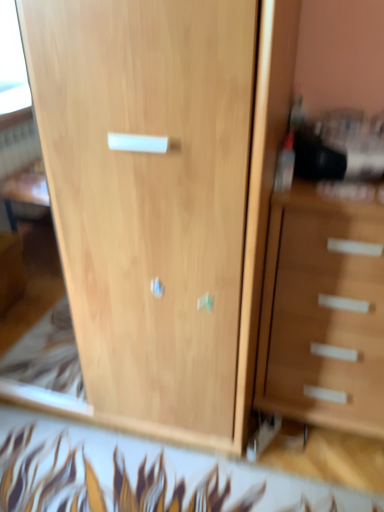
The height and width of the screenshot is (512, 384). What do you see at coordinates (324, 310) in the screenshot? I see `wooden chest of drawers at right` at bounding box center [324, 310].

The height and width of the screenshot is (512, 384). I want to click on wooden chest of drawers at right, so click(324, 310).

This screenshot has height=512, width=384. What do you see at coordinates (163, 196) in the screenshot? I see `light wood cupboard at center` at bounding box center [163, 196].

Identify the location of light wood cupboard at center. The height and width of the screenshot is (512, 384). (163, 196).

Identify the location of wooden chest of drawers at right. The width and height of the screenshot is (384, 512). (324, 310).

Which object is positioned more to the right, wooden chest of drawers at right or light wood cupboard at center?

wooden chest of drawers at right is more to the right.

Which object is closer to the camera, wooden chest of drawers at right or light wood cupboard at center?

light wood cupboard at center is more forward.

Between point (272, 270) and point (182, 282), which one is positioned in front?

Positioned in front is point (182, 282).

From the image's perspective, is wooden chest of drawers at right positioned above or below light wood cupboard at center?

wooden chest of drawers at right is situated lower than light wood cupboard at center in the image.

From a real-world perspective, between wooden chest of drawers at right and light wood cupboard at center, who is vertically higher?

light wood cupboard at center, from a real-world perspective.

Considering the relative sizes of wooden chest of drawers at right and light wood cupboard at center in the image provided, is wooden chest of drawers at right wider than light wood cupboard at center?

No, wooden chest of drawers at right is not wider than light wood cupboard at center.

Between wooden chest of drawers at right and light wood cupboard at center, which one has less height?

wooden chest of drawers at right.

Does wooden chest of drawers at right have a larger size compared to light wood cupboard at center?

Actually, wooden chest of drawers at right might be smaller than light wood cupboard at center.

Is wooden chest of drawers at right outside of light wood cupboard at center?

Yes, wooden chest of drawers at right is outside of light wood cupboard at center.

Are wooden chest of drawers at right and light wood cupboard at center making contact?

There is a gap between wooden chest of drawers at right and light wood cupboard at center.

Is wooden chest of drawers at right positioned with its back to light wood cupboard at center?

wooden chest of drawers at right is not turned away from light wood cupboard at center.

How many degrees apart are the facing directions of wooden chest of drawers at right and light wood cupboard at center?

0.0132 degrees separate the facing orientations of wooden chest of drawers at right and light wood cupboard at center.

Locate an element on the screen. This screenshot has height=512, width=384. the chest of drawers below the light wood cupboard at center (from the image's perspective) is located at coordinates (324, 310).

Which is more to the right, light wood cupboard at center or wooden chest of drawers at right?

Positioned to the right is wooden chest of drawers at right.

Which object is closer to the camera, light wood cupboard at center or wooden chest of drawers at right?

light wood cupboard at center is in front.

Does point (162, 411) come closer to viewer compared to point (304, 243)?

No.

From the image's perspective, between light wood cupboard at center and wooden chest of drawers at right, who is located below?

wooden chest of drawers at right, from the image's perspective.

From a real-world perspective, relative to wooden chest of drawers at right, is light wood cupboard at center vertically above or below?

light wood cupboard at center is situated higher than wooden chest of drawers at right in the real world.

In the scene shown: Which of these two, light wood cupboard at center or wooden chest of drawers at right, is wider?

light wood cupboard at center is wider.

From their relative heights in the image, would you say light wood cupboard at center is taller or shorter than wooden chest of drawers at right?

Clearly, light wood cupboard at center is taller compared to wooden chest of drawers at right.

Is light wood cupboard at center bigger or smaller than wooden chest of drawers at right?

In the image, light wood cupboard at center appears to be larger than wooden chest of drawers at right.

Is light wood cupboard at center located outside wooden chest of drawers at right?

Absolutely, light wood cupboard at center is external to wooden chest of drawers at right.

Is light wood cupboard at center next to wooden chest of drawers at right and touching it?

No, light wood cupboard at center is not beside wooden chest of drawers at right.

Is light wood cupboard at center oriented away from wooden chest of drawers at right?

No, light wood cupboard at center's orientation is not away from wooden chest of drawers at right.

Based on the photo, how different are the orientations of light wood cupboard at center and wooden chest of drawers at right in degrees?

They differ by 0.0132 degrees in their facing directions.

How distant is light wood cupboard at center from wooden chest of drawers at right?

A distance of 32.64 centimeters exists between light wood cupboard at center and wooden chest of drawers at right.

Locate an element on the screen. This screenshot has height=512, width=384. the chest of drawers that appears below the light wood cupboard at center (from the image's perspective) is located at coordinates 324,310.

What are the coordinates of `chest of drawers behind the light wood cupboard at center` in the screenshot? It's located at (324, 310).

Where is `cupboard positioned vertically above the wooden chest of drawers at right (from a real-world perspective)`? This screenshot has width=384, height=512. cupboard positioned vertically above the wooden chest of drawers at right (from a real-world perspective) is located at coordinates (163, 196).